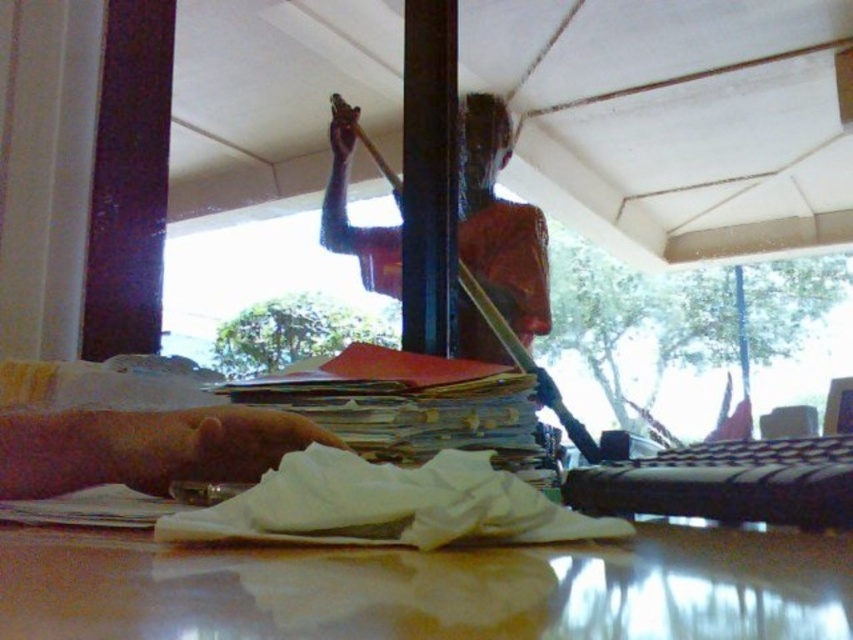
Is smooth brown skin at upper center below pink skin at lower left?

No, smooth brown skin at upper center is not below pink skin at lower left.

Can you confirm if smooth brown skin at upper center is shorter than pink skin at lower left?

In fact, smooth brown skin at upper center may be taller than pink skin at lower left.

Who is more forward, [476,118] or [270,413]?

Positioned in front is point [270,413].

This screenshot has height=640, width=853. I want to click on smooth brown skin at upper center, so click(498, 221).

Looking at this image, is glossy wooden table at center behind smooth brown skin at upper center?

No, glossy wooden table at center is closer to the viewer.

Does point (521, 636) come farther from viewer compared to point (505, 314)?

No, (521, 636) is closer to viewer.

What do you see at coordinates (428, 589) in the screenshot? Image resolution: width=853 pixels, height=640 pixels. I see `glossy wooden table at center` at bounding box center [428, 589].

In order to click on glossy wooden table at center in this screenshot , I will do `click(428, 589)`.

Is the position of glossy wooden table at center less distant than that of pink skin at lower left?

Yes.

Can you confirm if glossy wooden table at center is positioned to the left of pink skin at lower left?

In fact, glossy wooden table at center is to the right of pink skin at lower left.

Identify the location of glossy wooden table at center. Image resolution: width=853 pixels, height=640 pixels. (428, 589).